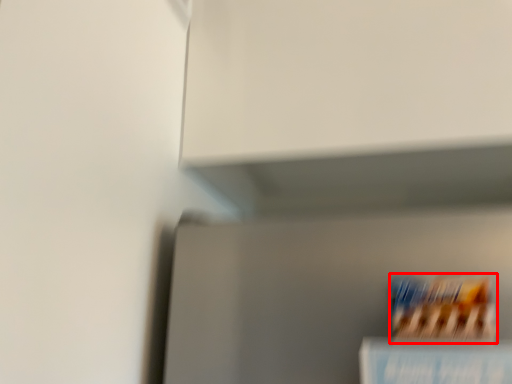
Question: Considering the relative positions of cereal (annotated by the red box) and book in the image provided, where is cereal (annotated by the red box) located with respect to the staircase?

Choices:
 (A) right
 (B) left

Answer: (A)